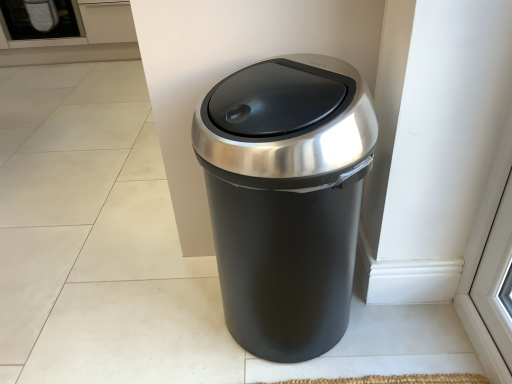
Question: Should I look upward or downward to see white frosted glass screen door at upper left?

Choices:
 (A) down
 (B) up

Answer: (B)

Question: Is white frosted glass screen door at upper left taller than black matte trash can at center?

Choices:
 (A) no
 (B) yes

Answer: (A)

Question: Is white frosted glass screen door at upper left to the left of black matte trash can at center from the viewer's perspective?

Choices:
 (A) no
 (B) yes

Answer: (B)

Question: Is white frosted glass screen door at upper left outside black matte trash can at center?

Choices:
 (A) yes
 (B) no

Answer: (A)

Question: From the image's perspective, is white frosted glass screen door at upper left located above black matte trash can at center?

Choices:
 (A) yes
 (B) no

Answer: (A)

Question: Considering the relative sizes of white frosted glass screen door at upper left and black matte trash can at center in the image provided, is white frosted glass screen door at upper left wider than black matte trash can at center?

Choices:
 (A) no
 (B) yes

Answer: (B)

Question: Could black matte trash can at center be considered to be inside white frosted glass screen door at upper left?

Choices:
 (A) yes
 (B) no

Answer: (B)

Question: Can you confirm if black matte trash can at center is shorter than white frosted glass screen door at upper left?

Choices:
 (A) no
 (B) yes

Answer: (A)

Question: Considering the relative positions of black matte trash can at center and white frosted glass screen door at upper left in the image provided, is black matte trash can at center to the left of white frosted glass screen door at upper left from the viewer's perspective?

Choices:
 (A) yes
 (B) no

Answer: (B)

Question: Considering the relative positions of black matte trash can at center and white frosted glass screen door at upper left in the image provided, is black matte trash can at center in front of white frosted glass screen door at upper left?

Choices:
 (A) yes
 (B) no

Answer: (A)

Question: From a real-world perspective, is black matte trash can at center beneath white frosted glass screen door at upper left?

Choices:
 (A) no
 (B) yes

Answer: (B)

Question: Can you confirm if black matte trash can at center is positioned to the right of white frosted glass screen door at upper left?

Choices:
 (A) yes
 (B) no

Answer: (A)

Question: Is black matte trash can at center directly adjacent to white frosted glass screen door at upper left?

Choices:
 (A) no
 (B) yes

Answer: (A)

Question: Would you say white frosted glass screen door at upper left is to the left or to the right of black matte trash can at center in the picture?

Choices:
 (A) right
 (B) left

Answer: (B)